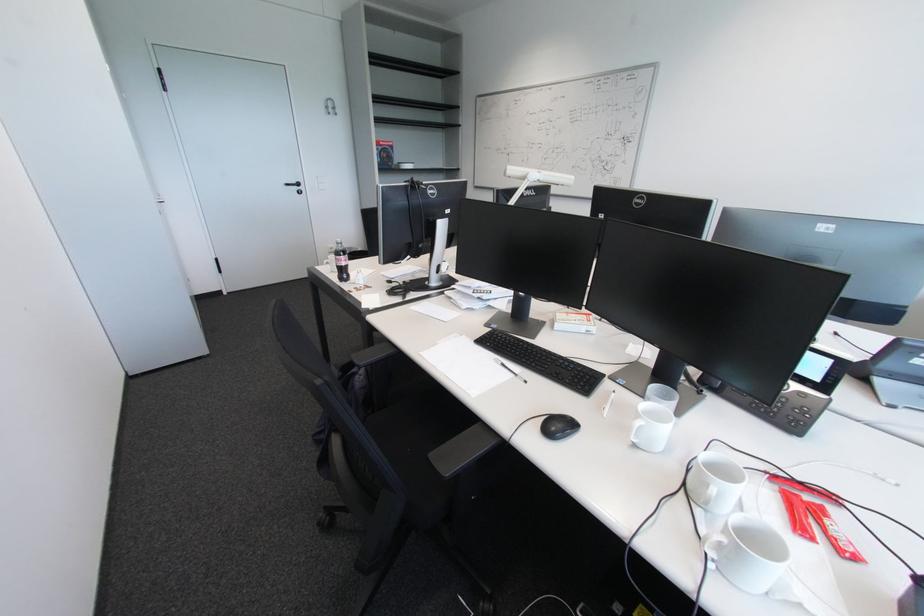
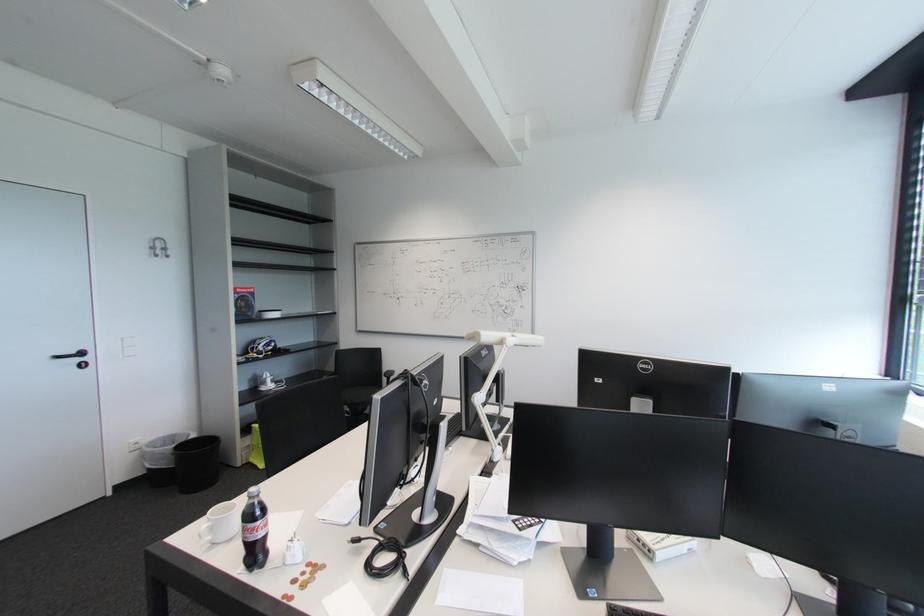
Where in the second image is the point corresponding to [387,145] from the first image?

(246, 292)